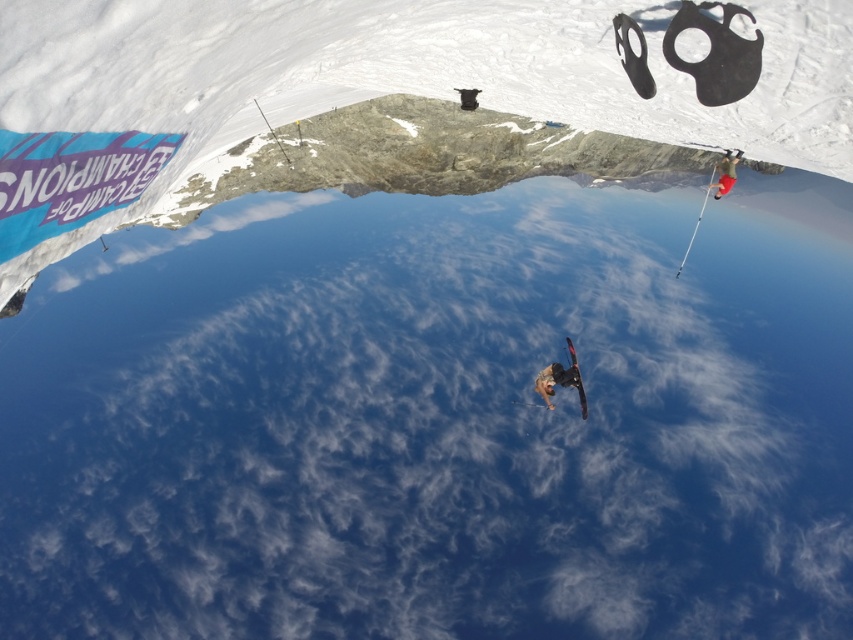
Question: Which point appears farthest from the camera in this image?

Choices:
 (A) (728, 168)
 (B) (560, 364)
 (C) (581, 387)

Answer: (C)

Question: Can you confirm if red fabric pants at right is positioned above black matte parachute at center?

Choices:
 (A) yes
 (B) no

Answer: (A)

Question: Observing the image, what is the correct spatial positioning of dark gray snowboarder at center in reference to black matte parachute at center?

Choices:
 (A) left
 (B) right

Answer: (B)

Question: Which point is farther to the camera?

Choices:
 (A) red fabric pants at right
 (B) dark gray snowboarder at center

Answer: (B)

Question: Can you confirm if red fabric pants at right is positioned below black matte parachute at center?

Choices:
 (A) yes
 (B) no

Answer: (B)

Question: Estimate the real-world distances between objects in this image. Which object is closer to the red fabric pants at right?

Choices:
 (A) dark gray snowboarder at center
 (B) black matte parachute at center

Answer: (B)